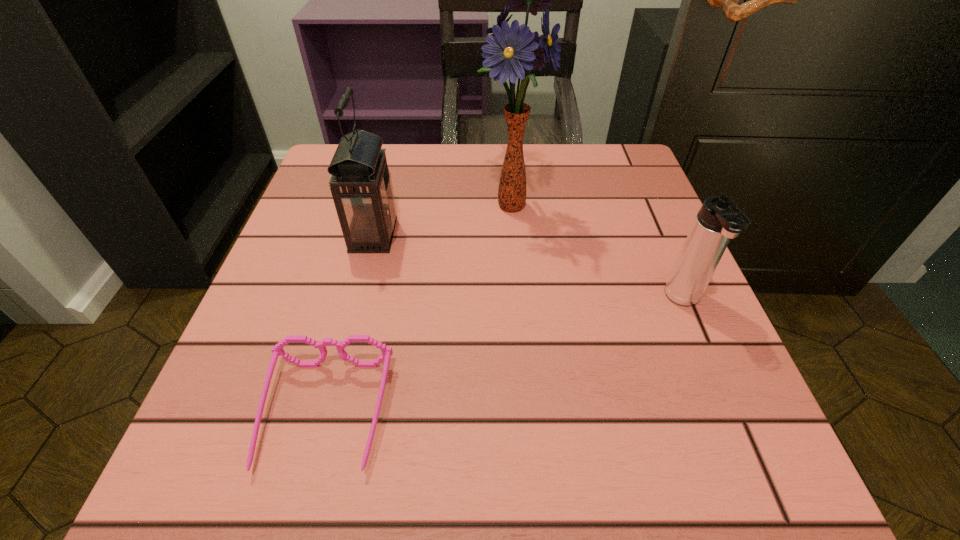
At what (x,y) coordinates should I click in order to perform the action: click on object located in the far edge section of the desktop. Please return your answer as a coordinate pair (x, y). The height and width of the screenshot is (540, 960). Looking at the image, I should click on (512, 50).

Locate an element on the screen. Image resolution: width=960 pixels, height=540 pixels. object situated at the near edge is located at coordinates (278, 350).

Locate an element on the screen. This screenshot has height=540, width=960. lantern that is at the left edge is located at coordinates (361, 186).

You are a GUI agent. You are given a task and a screenshot of the screen. Output one action in this format:
    pyautogui.click(x=<x>, y=<y>)
    Task: Click on the spectacles at the left edge
    The image size is (960, 540).
    Given the screenshot: What is the action you would take?
    pyautogui.click(x=278, y=350)

Identify the location of object that is at the right edge. The width and height of the screenshot is (960, 540). (720, 218).

This screenshot has height=540, width=960. Identify the location of object situated at the near left corner. pos(278,350).

You are a GUI agent. You are given a task and a screenshot of the screen. Output one action in this format:
    pyautogui.click(x=<x>, y=<y>)
    Task: Click on the vacant space at the far edge of the desktop
    
    Given the screenshot: What is the action you would take?
    pyautogui.click(x=439, y=168)

Where is `vacant space at the near edge of the desktop`? vacant space at the near edge of the desktop is located at coordinates (452, 490).

Where is `free space at the left edge of the desktop`? The height and width of the screenshot is (540, 960). free space at the left edge of the desktop is located at coordinates (218, 430).

Image resolution: width=960 pixels, height=540 pixels. What are the coordinates of `vacant region at the right edge of the desktop` in the screenshot? It's located at coord(604,271).